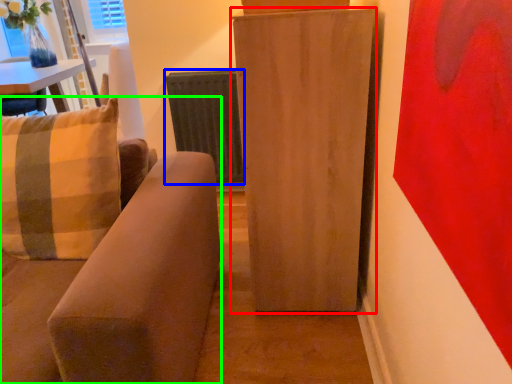
Question: Which object is positioned farthest from furniture (highlighted by a red box)? Select from radiator (highlighted by a blue box) and studio couch (highlighted by a green box).

Choices:
 (A) radiator
 (B) studio couch

Answer: (A)